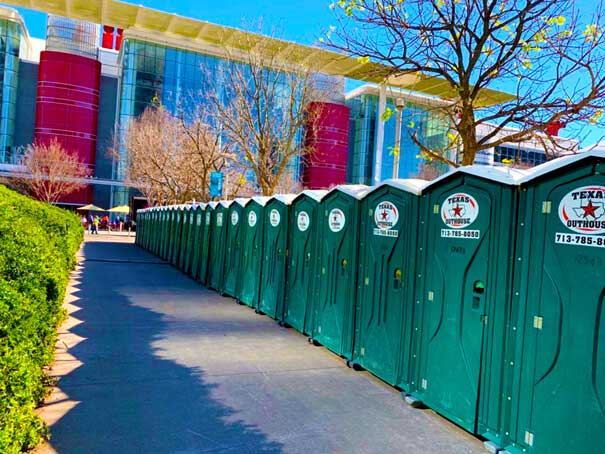
Locate an element on the screen. This screenshot has width=605, height=454. glass windows is located at coordinates (172, 73), (387, 137), (4, 67), (502, 150).